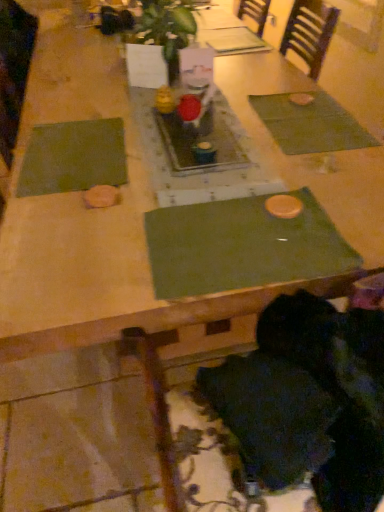
Locate an element on the screen. The width and height of the screenshot is (384, 512). unoccupied region to the right of green fabric place mat at left, which ranks as the 1th place mat in left-to-right order is located at coordinates (172, 158).